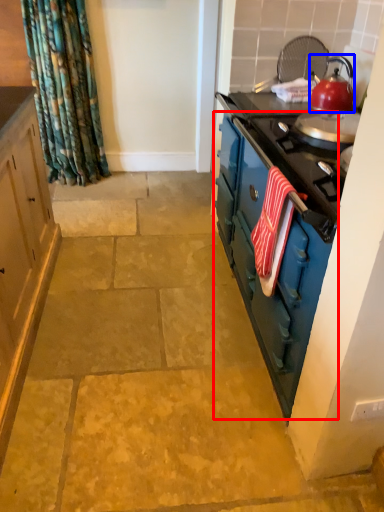
Question: Which object is further to the camera taking this photo, dresser (highlighted by a red box) or kitchen appliance (highlighted by a blue box)?

Choices:
 (A) dresser
 (B) kitchen appliance

Answer: (B)